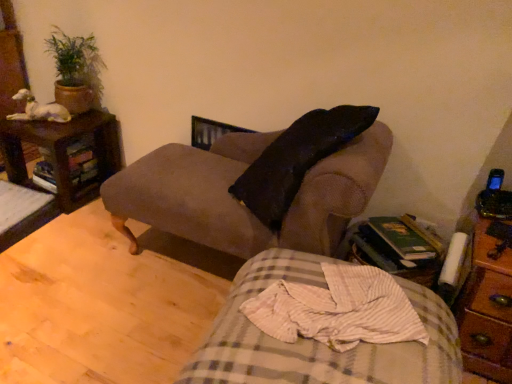
I want to click on unoccupied region to the right of white matte statue at upper left, so click(x=78, y=119).